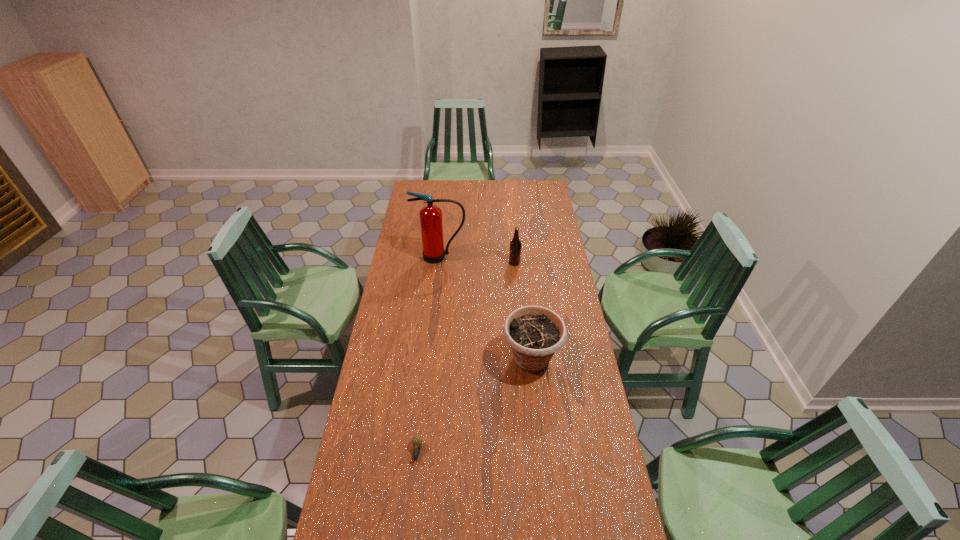
The image size is (960, 540). Identify the location of free space located on the front-facing side of the nearest object. (413, 492).

Locate an element on the screen. The image size is (960, 540). object at the left edge is located at coordinates (431, 222).

This screenshot has width=960, height=540. What are the coordinates of `object located in the right edge section of the desktop` in the screenshot? It's located at (534, 333).

The image size is (960, 540). In the image, there is a desktop. In order to click on vacant space at the far edge in this screenshot , I will do `click(463, 184)`.

The height and width of the screenshot is (540, 960). I want to click on vacant space at the left edge, so click(417, 234).

The height and width of the screenshot is (540, 960). Identify the location of free space at the right edge. (552, 212).

Where is `free space between the fire extinguisher and the nearest object`? This screenshot has height=540, width=960. free space between the fire extinguisher and the nearest object is located at coordinates (429, 354).

At what (x,y) coordinates should I click in order to perform the action: click on free space that is in between the beer bottle and the fire extinguisher. Please return your answer as a coordinate pair (x, y). Image resolution: width=960 pixels, height=540 pixels. Looking at the image, I should click on (477, 260).

The height and width of the screenshot is (540, 960). Identify the location of free space between the fire extinguisher and the nearest object. (429, 354).

Image resolution: width=960 pixels, height=540 pixels. I want to click on vacant space that's between the beer bottle and the escargot, so click(466, 357).